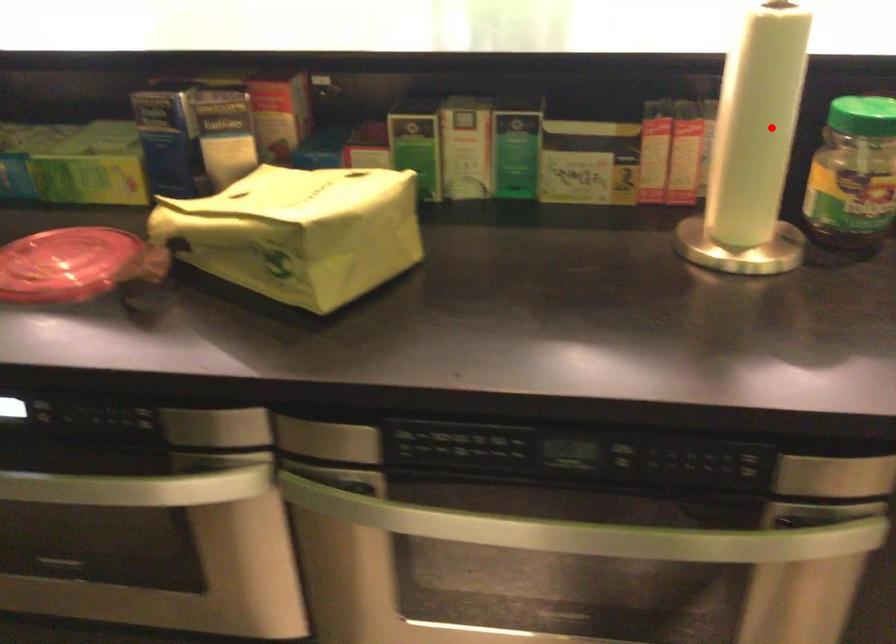
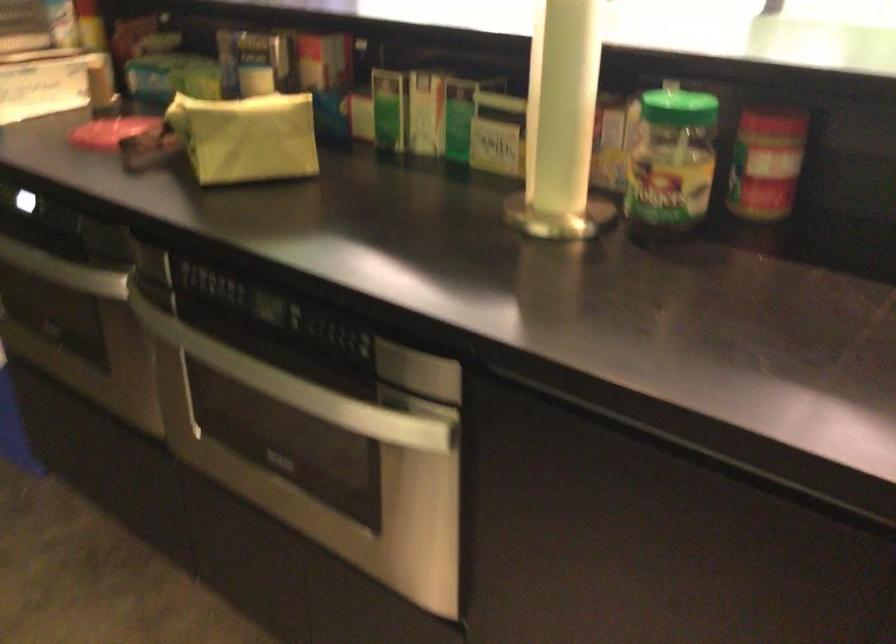
Question: A red point is marked in image1. In image2, is the corresponding 3D point closer to the camera or farther? Reply with the corresponding letter.

Choices:
 (A) The corresponding 3D point is closer.
 (B) The corresponding 3D point is farther.

Answer: (B)